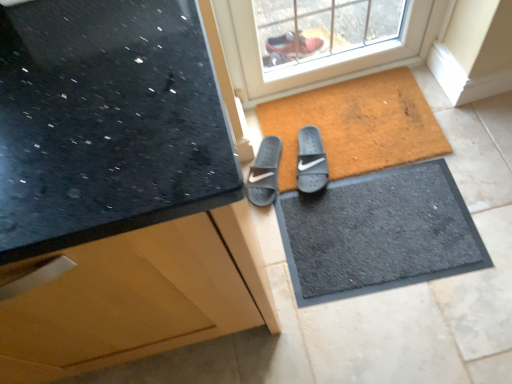
At what (x,y) coordinates should I click in order to perform the action: click on free space in front of black rubber doormat at center. Please return your answer as a coordinate pair (x, y). Looking at the image, I should click on (412, 328).